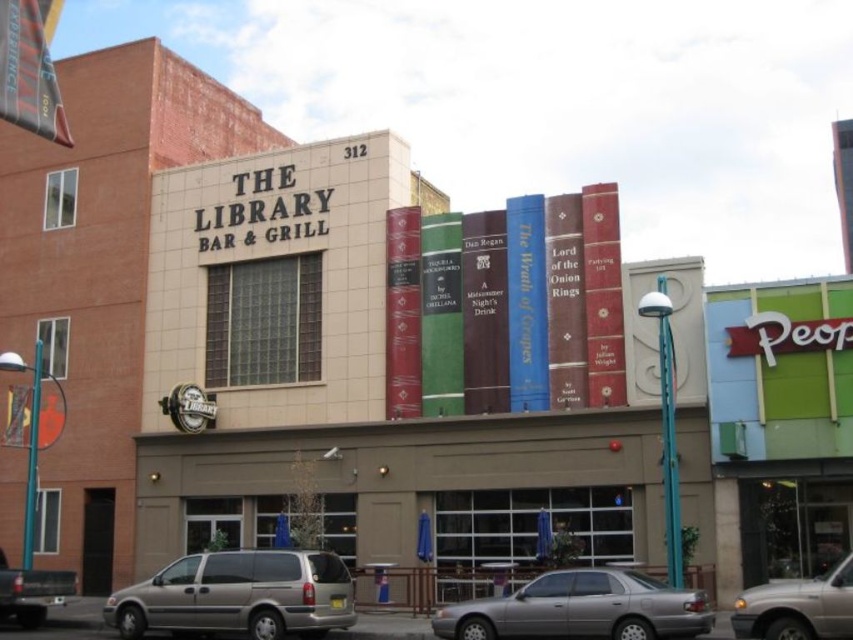
You are a delivery driver arriving at The Library Bar and Grill. You need to park your gold metallic minivan at lower center and silver metallic sedan at lower center in the parking lot. According to the spatial arrangement, which vehicle should be parked first to ensure proper positioning?

The gold metallic minivan at lower center should be parked first because it is positioned below the silver metallic sedan at lower center, indicating it needs to be placed in the lower parking spot before the sedan above it.

You are driving a delivery truck that is 7 meters long and need to park between the gold metallic minivan at lower center and the matte silver van at lower left. The parking spot can only accommodate vehicles up to 10 meters in total length. Can both your truck and the two vans fit in the spot without overlapping?

The gold metallic minivan at lower center and matte silver van at lower left are 10.16 meters apart from each other. Since the parking spot can only accommodate up to 10 meters, the total length of the two vans plus your 7 meter truck would exceed the limit. Therefore, they cannot all fit without overlapping.